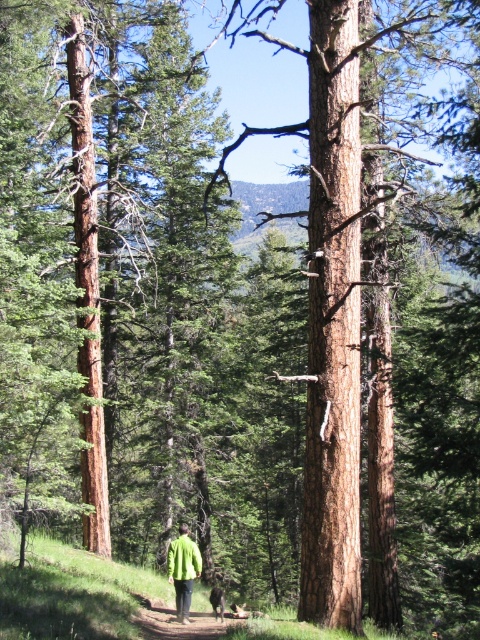
Question: Which of the following is the closest to the observer?

Choices:
 (A) green fuzzy jacket at lower center
 (B) green matte jacket at center
 (C) brown fur dog at center

Answer: (A)

Question: Is green matte jacket at center to the left of brown fur dog at center from the viewer's perspective?

Choices:
 (A) yes
 (B) no

Answer: (A)

Question: Is green fuzzy jacket at lower center bigger than brown fur dog at center?

Choices:
 (A) no
 (B) yes

Answer: (A)

Question: Which object is the farthest from the green matte jacket at center?

Choices:
 (A) brown fur dog at center
 (B) green fuzzy jacket at lower center

Answer: (A)

Question: From the image, what is the correct spatial relationship of green fuzzy jacket at lower center in relation to brown fur dog at center?

Choices:
 (A) above
 (B) below

Answer: (A)

Question: Estimate the real-world distances between objects in this image. Which object is farther from the green matte jacket at center?

Choices:
 (A) brown fur dog at center
 (B) green fuzzy jacket at lower center

Answer: (A)